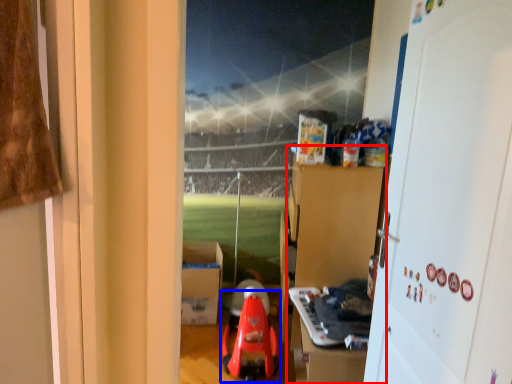
Question: Which object appears farthest to the camera in this image, dresser (highlighted by a red box) or toy (highlighted by a blue box)?

Choices:
 (A) dresser
 (B) toy

Answer: (A)